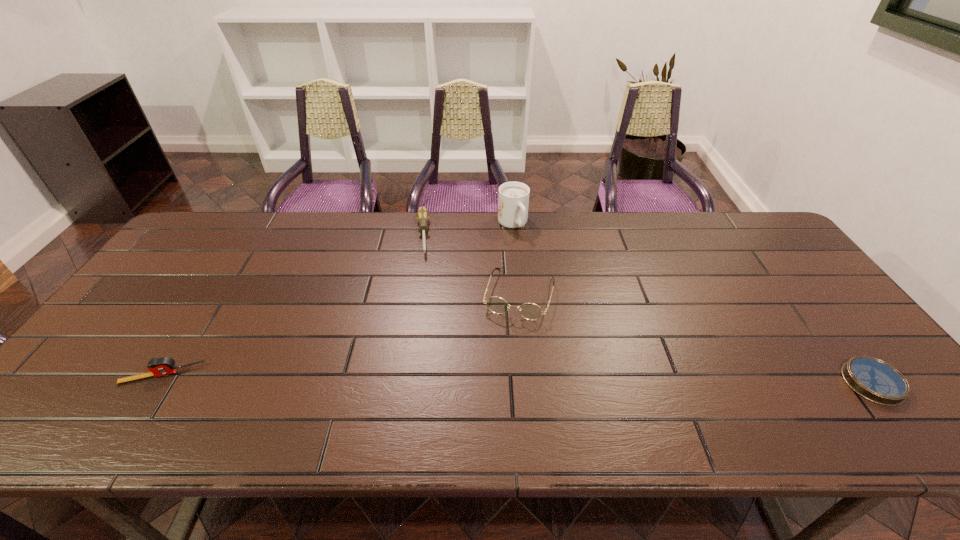
Identify the location of vacant region located 0.080m on the lenses of the spectacles. (505, 345).

This screenshot has width=960, height=540. In order to click on vacant space located on the lenses of the spectacles in this screenshot , I will do `click(505, 345)`.

I want to click on vacant space situated at the tip of the screwdriver, so click(422, 347).

At what (x,y) coordinates should I click in order to perform the action: click on free space located 0.140m at the tip of the screwdriver. Please return your answer as a coordinate pair (x, y). The height and width of the screenshot is (540, 960). Looking at the image, I should click on (420, 290).

Find the location of a particular element. blank space located at the tip of the screwdriver is located at coordinates (422, 332).

Image resolution: width=960 pixels, height=540 pixels. I want to click on free space located on the side with the handle of the cappuccino, so click(x=537, y=264).

Locate an element on the screen. The image size is (960, 540). vacant area situated 0.130m on the side with the handle of the cappuccino is located at coordinates (534, 260).

Where is `free spot located on the side with the handle of the cappuccino`? The height and width of the screenshot is (540, 960). free spot located on the side with the handle of the cappuccino is located at coordinates (555, 292).

You are a GUI agent. You are given a task and a screenshot of the screen. Output one action in this format:
    pyautogui.click(x=<x>, y=<y>)
    Task: Click on the screwdriver at the far edge
    
    Given the screenshot: What is the action you would take?
    pyautogui.click(x=422, y=215)

The image size is (960, 540). Find the location of `cappuccino situated at the far edge`. cappuccino situated at the far edge is located at coordinates (513, 201).